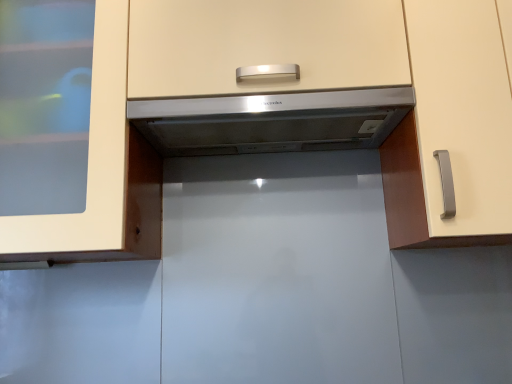
What do you see at coordinates (271, 121) in the screenshot? I see `satin silver range hood at center` at bounding box center [271, 121].

The image size is (512, 384). Find the location of `satin silver range hood at center`. satin silver range hood at center is located at coordinates (271, 121).

This screenshot has height=384, width=512. Identify the location of satin silver range hood at center. (271, 121).